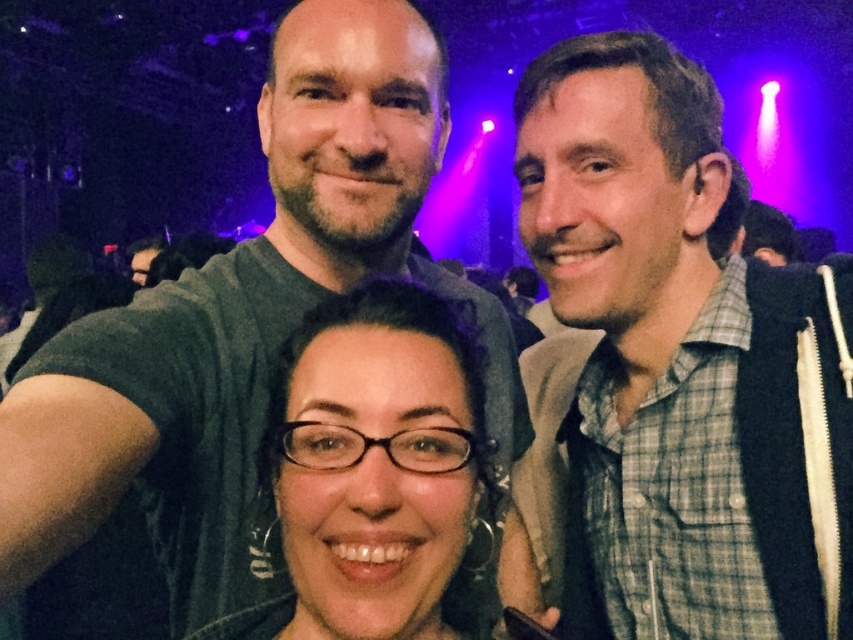
Does green plaid shirt at center have a lesser width compared to matte black glasses at center?

In fact, green plaid shirt at center might be wider than matte black glasses at center.

Which is behind, point (675, 284) or point (407, 480)?

Point (675, 284)

This screenshot has width=853, height=640. What do you see at coordinates (672, 371) in the screenshot? I see `green plaid shirt at center` at bounding box center [672, 371].

Locate an element on the screen. This screenshot has width=853, height=640. green plaid shirt at center is located at coordinates (672, 371).

Consider the image. Is green plaid shirt at center shorter than dark gray t-shirt at center?

Yes, green plaid shirt at center is shorter than dark gray t-shirt at center.

Locate an element on the screen. This screenshot has height=640, width=853. green plaid shirt at center is located at coordinates (672, 371).

Who is more distant from viewer, [577,275] or [328,269]?

Positioned behind is point [328,269].

Locate an element on the screen. The width and height of the screenshot is (853, 640). green plaid shirt at center is located at coordinates (672, 371).

Is dark gray t-shirt at center smaller than matte black glasses at center?

Actually, dark gray t-shirt at center might be larger than matte black glasses at center.

Is dark gray t-shirt at center above matte black glasses at center?

Indeed, dark gray t-shirt at center is positioned over matte black glasses at center.

Image resolution: width=853 pixels, height=640 pixels. Find the location of `dark gray t-shirt at center`. dark gray t-shirt at center is located at coordinates (245, 316).